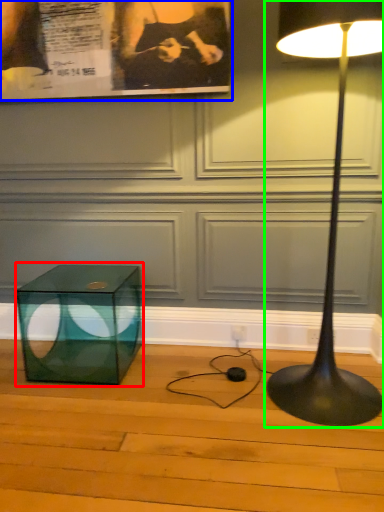
Question: Considering the real-world distances, which object is farthest from table (highlighted by a red box)? poster page (highlighted by a blue box) or lamp (highlighted by a green box)?

Choices:
 (A) poster page
 (B) lamp

Answer: (B)